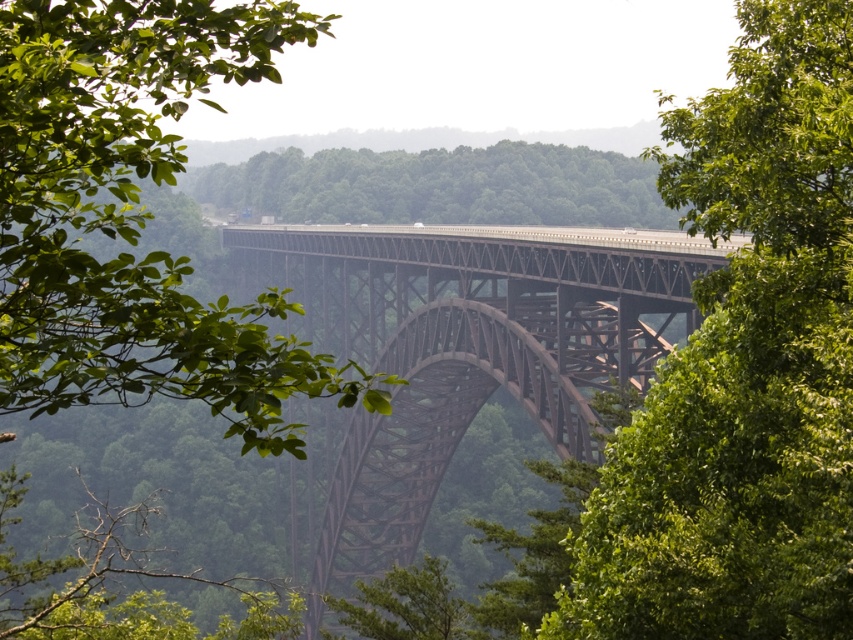
Question: Among these points, which one is nearest to the camera?

Choices:
 (A) (645, 369)
 (B) (741, 460)

Answer: (B)

Question: Among these points, which one is farthest from the camera?

Choices:
 (A) (361, 497)
 (B) (788, 227)

Answer: (A)

Question: Does green leafy tree at center have a larger size compared to rusty metal bridge at center?

Choices:
 (A) no
 (B) yes

Answer: (A)

Question: Does green leafy tree at center have a smaller size compared to rusty metal bridge at center?

Choices:
 (A) yes
 (B) no

Answer: (A)

Question: From the image, what is the correct spatial relationship of green leafy tree at center in relation to rusty metal bridge at center?

Choices:
 (A) left
 (B) right

Answer: (B)